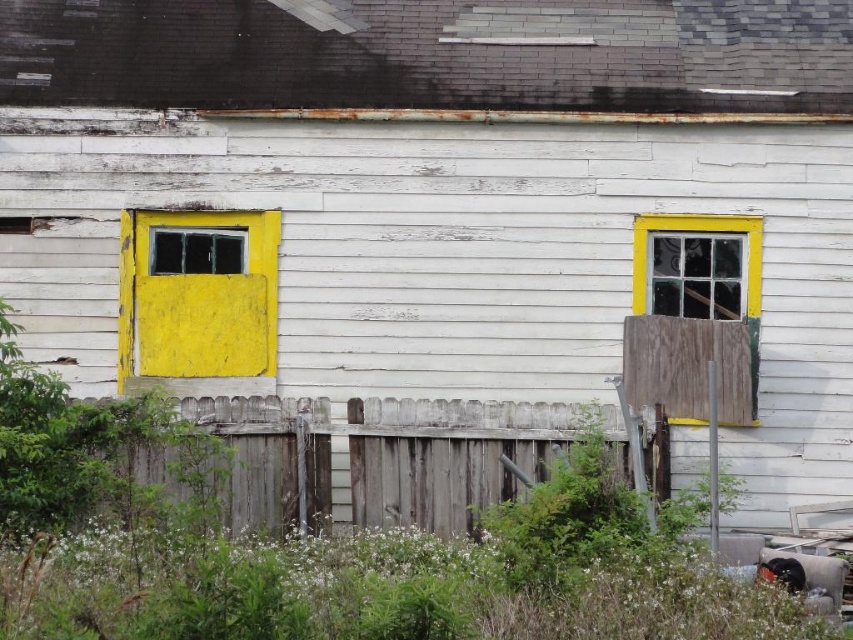
You are a delivery person approaching the house and need to reach the yellow matte door at left. There is a weathered wood fence at lower center in your path. Can you walk through the fence to reach the door?

The weathered wood fence at lower center is positioned under the yellow matte door at left, meaning the fence is below the door. Since fences are typically solid barriers, you cannot walk through the fence to reach the yellow matte door at left. You may need to go around the fence or find another entrance.

You are a delivery person trying to deliver a package to the yellow matte door at left. The package is too large to carry over the weathered wood fence at lower center. Can you walk around the fence to reach the door?

The weathered wood fence at lower center is not as tall as yellow matte door at left, so you can walk around the fence to reach the yellow matte door at left.

Consider the image. You are standing in front of the abandoned house and want to determine the relative positions of two points marked on the house. Which point is closer to you, point (321, 429) or point (160, 256)?

Point (321, 429) is closer to the viewer than point (160, 256).